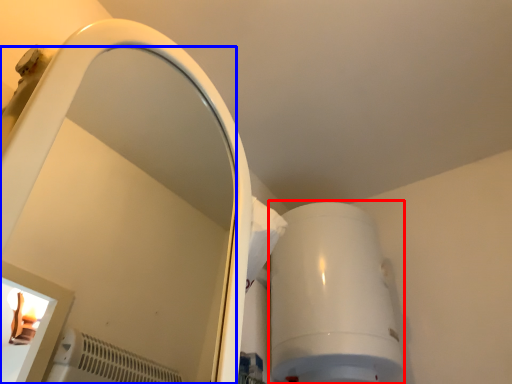
Question: Among these objects, which one is farthest to the camera, appliance (highlighted by a red box) or mirror (highlighted by a blue box)?

Choices:
 (A) appliance
 (B) mirror

Answer: (A)